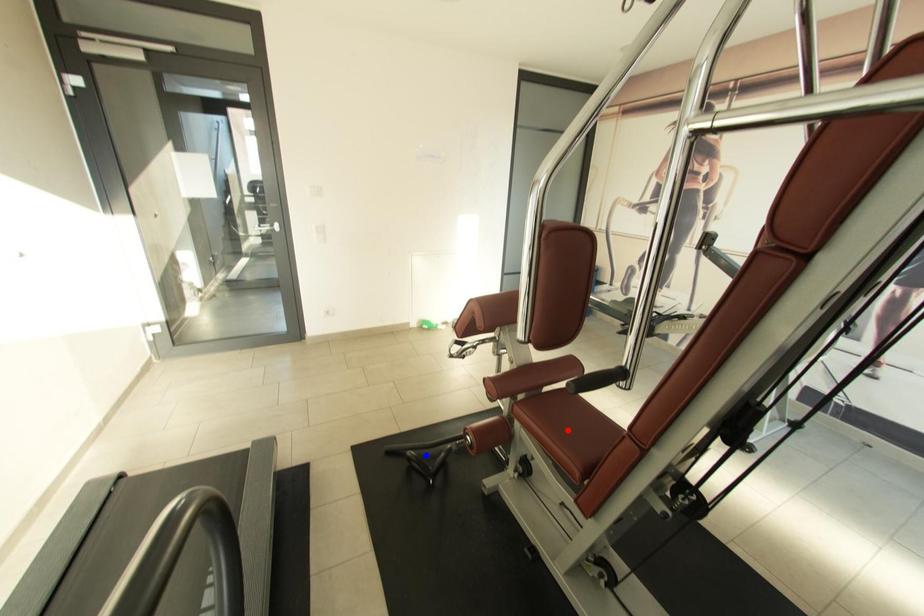
Question: In the image, two points are highlighted. Which point is nearer to the camera? Reply with the corresponding letter.

Choices:
 (A) blue point
 (B) red point

Answer: (B)